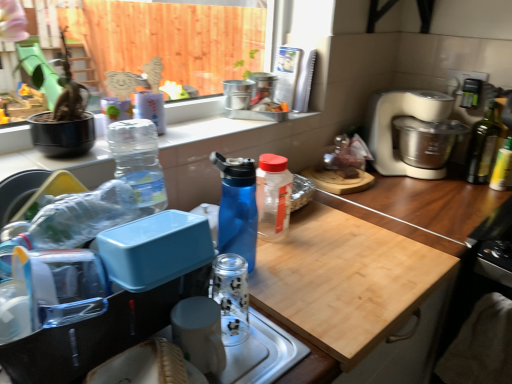
Find the location of a particular element. vacant space in front of transparent plastic bottle at center, which is counted as the third bottle, starting from the left is located at coordinates (288, 267).